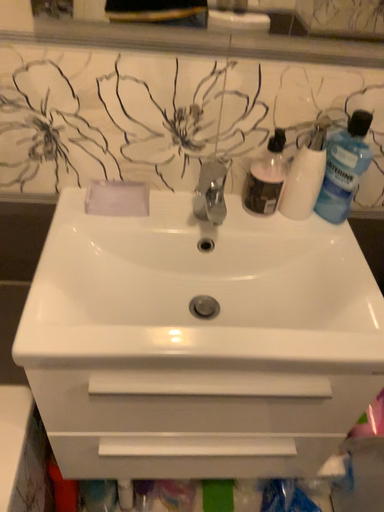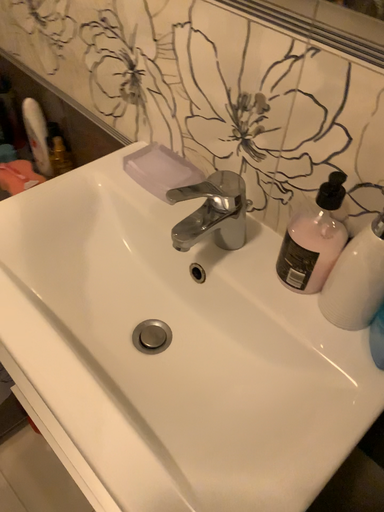
Question: Which way did the camera rotate in the video?

Choices:
 (A) rotated right
 (B) rotated left

Answer: (B)